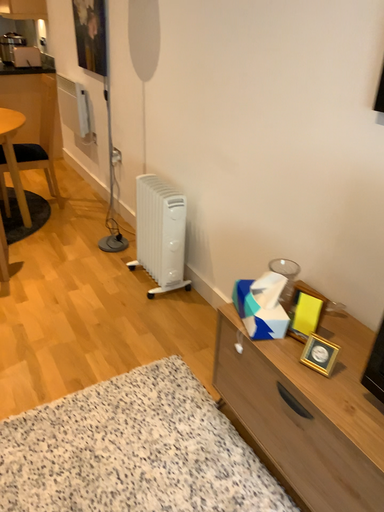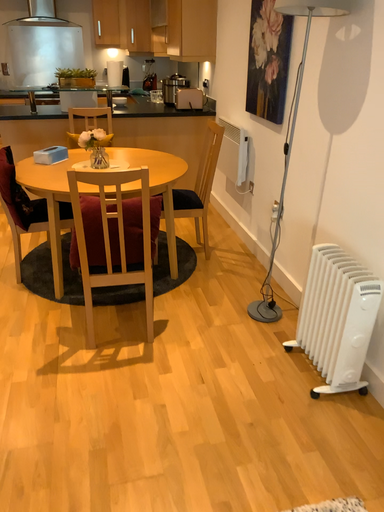
Question: How did the camera likely rotate when shooting the video?

Choices:
 (A) rotated right
 (B) rotated left

Answer: (B)